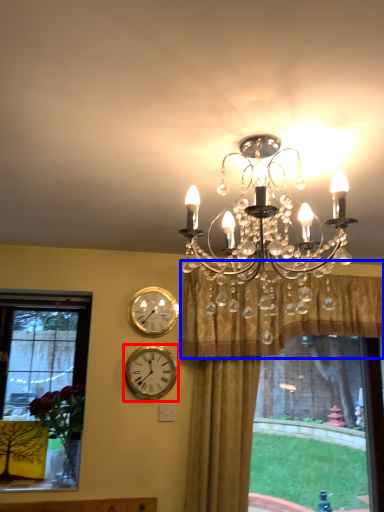
Question: Which object appears closest to the camera in this image, wall clock (highlighted by a red box) or curtain (highlighted by a blue box)?

Choices:
 (A) wall clock
 (B) curtain

Answer: (B)